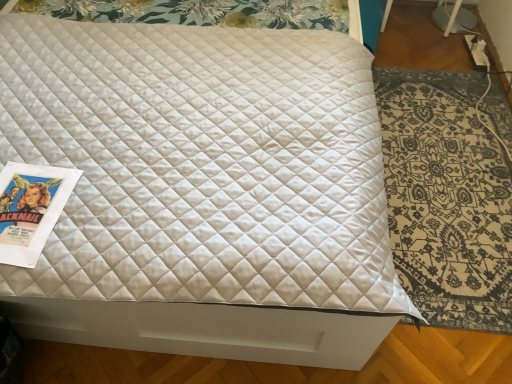
At what (x,y) coordinates should I click in order to perform the action: click on blank area beneath beige patterned rug at lower right (from a real-world perspective). Please return your answer as a coordinate pair (x, y). Image resolution: width=512 pixels, height=384 pixels. Looking at the image, I should click on (452, 178).